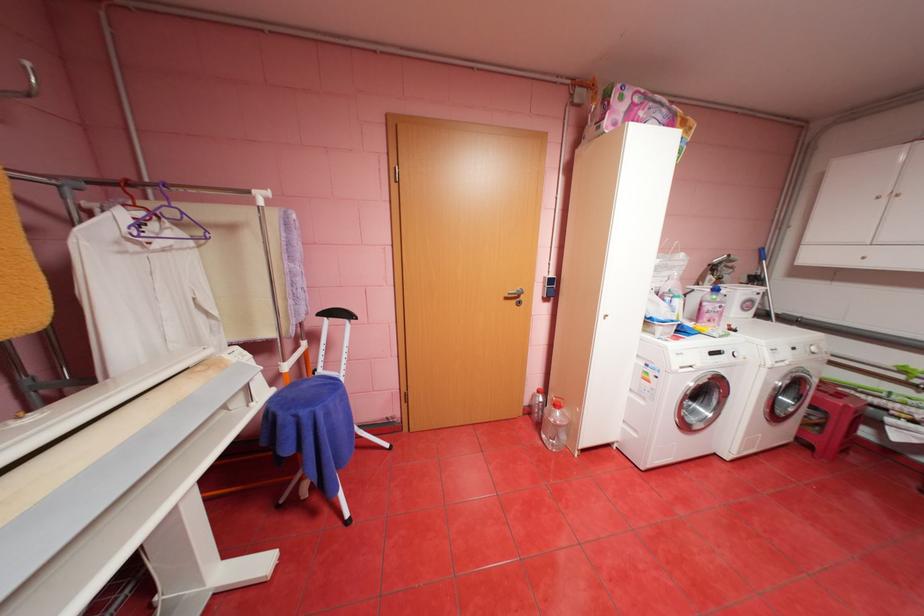
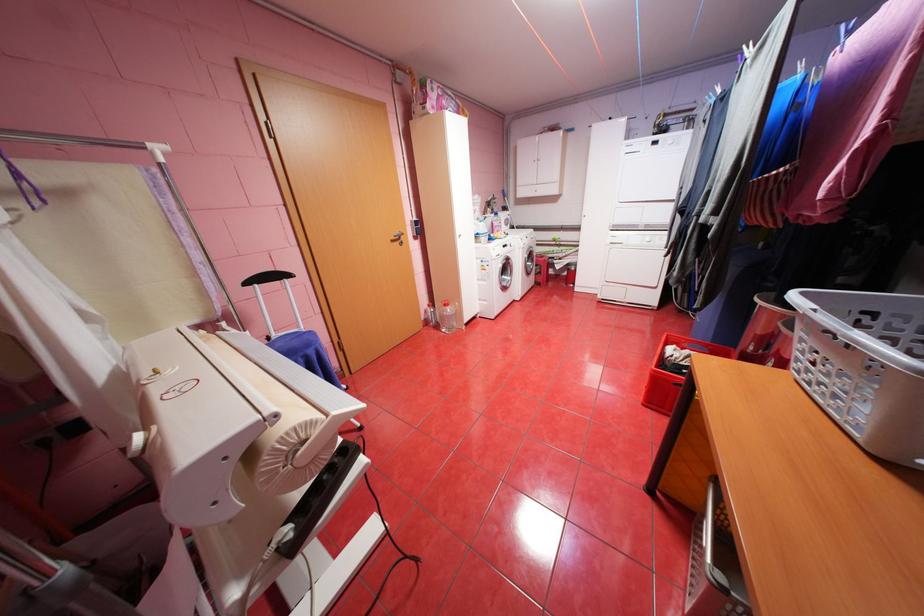
Where in the second image is the point corresponding to (515,298) from the first image?

(400, 241)